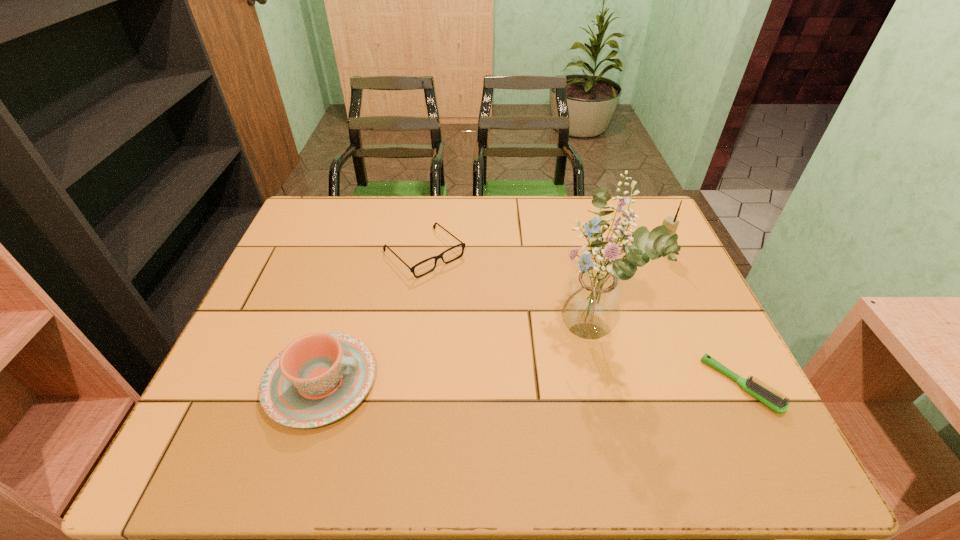
The image size is (960, 540). I want to click on object that is at the left edge, so click(x=319, y=378).

In order to click on hairbrush at the right edge in this screenshot , I will do [772, 400].

Where is `cellular telephone present at the right edge`? cellular telephone present at the right edge is located at coordinates (671, 223).

The image size is (960, 540). What are the coordinates of `object that is at the near left corner` in the screenshot? It's located at (319, 378).

This screenshot has height=540, width=960. What are the coordinates of `object located in the near right corner section of the desktop` in the screenshot? It's located at (772, 400).

The width and height of the screenshot is (960, 540). I want to click on vacant region at the far edge, so click(x=387, y=216).

Find the location of a particular element. vacant point at the near edge is located at coordinates (589, 413).

This screenshot has width=960, height=540. Identify the location of blank space at the left edge. (299, 330).

Locate an element on the screen. The width and height of the screenshot is (960, 540). vacant space at the right edge of the desktop is located at coordinates tap(702, 332).

The height and width of the screenshot is (540, 960). Identify the location of vacant space at the far left corner of the desktop. 322,228.